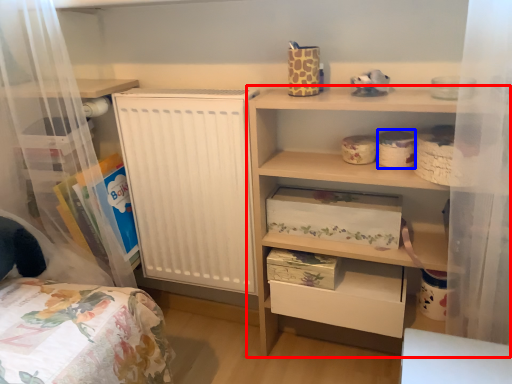
Question: Which object appears closest to the camera in this image, shelf (highlighted by a red box) or storage box (highlighted by a blue box)?

Choices:
 (A) shelf
 (B) storage box

Answer: (A)